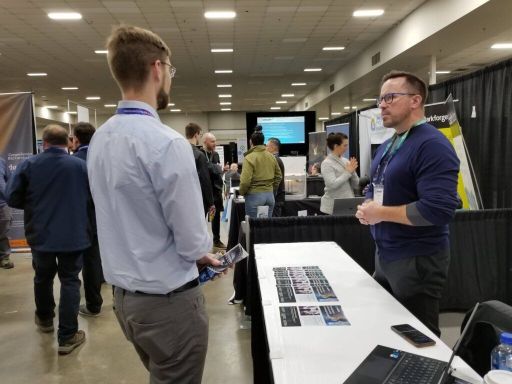
The height and width of the screenshot is (384, 512). I want to click on table, so click(x=327, y=345), click(x=302, y=202).